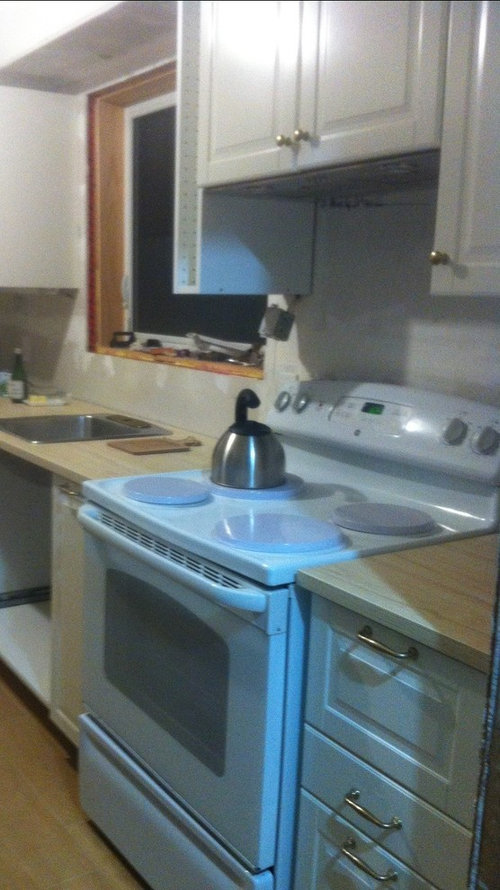
Locate an element on the screen. This screenshot has height=890, width=500. cupboard knob handles is located at coordinates (436, 259), (300, 133), (278, 140).